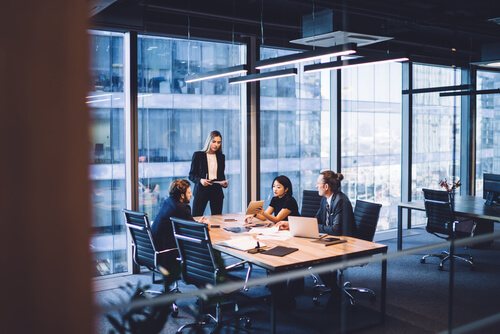
You are a GUI agent. You are given a task and a screenshot of the screen. Output one action in this format:
    pyautogui.click(x=<x>, y=<y>)
    Task: Click on the chairs
    Image resolution: width=500 pixels, height=334 pixels.
    Given the screenshot: What is the action you would take?
    pyautogui.click(x=144, y=242), pyautogui.click(x=191, y=252), pyautogui.click(x=307, y=200), pyautogui.click(x=364, y=212), pyautogui.click(x=439, y=212)